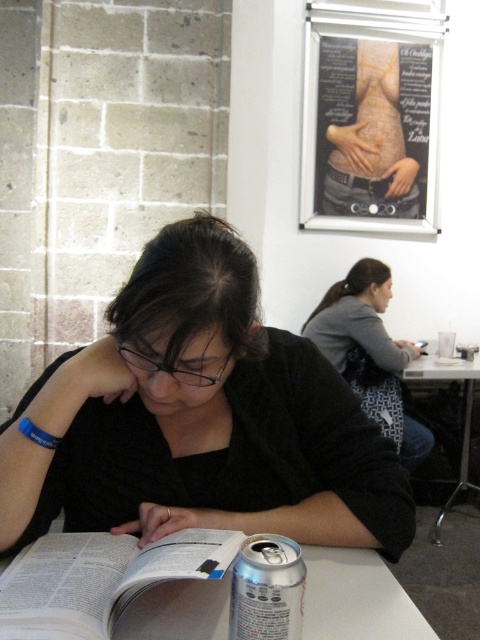
How much distance is there between black matte book at center and silver metallic can at lower center?

The distance of black matte book at center from silver metallic can at lower center is 23.22 centimeters.

The height and width of the screenshot is (640, 480). What do you see at coordinates (199, 419) in the screenshot? I see `black matte book at center` at bounding box center [199, 419].

Who is more forward, (359, 449) or (292, 621)?

Point (292, 621) is in front.

Image resolution: width=480 pixels, height=640 pixels. Identify the location of black matte book at center. (199, 419).

Between gray fabric shirt at upper right and metallic silver table at lower right, which one is positioned lower?

metallic silver table at lower right

In the scene shown: Does gray fabric shirt at upper right appear on the right side of metallic silver table at lower right?

No, gray fabric shirt at upper right is not to the right of metallic silver table at lower right.

Describe the element at coordinates (370, 353) in the screenshot. I see `gray fabric shirt at upper right` at that location.

The height and width of the screenshot is (640, 480). I want to click on gray fabric shirt at upper right, so click(x=370, y=353).

Locate an element on the screen. gray fabric shirt at upper right is located at coordinates (370, 353).

Which is behind, point (386, 300) or point (304, 564)?

The point (386, 300) is behind.

This screenshot has height=640, width=480. Identify the location of gray fabric shirt at upper right. (370, 353).